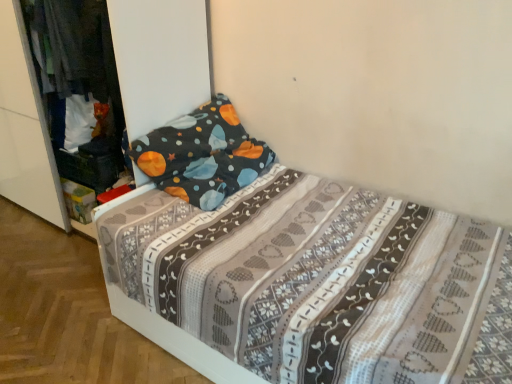
Question: Considering their positions, is dark blue fabric at left located in front of or behind white fabric bed at center?

Choices:
 (A) front
 (B) behind

Answer: (B)

Question: From a real-world perspective, is dark blue fabric at left physically located above or below white fabric bed at center?

Choices:
 (A) below
 (B) above

Answer: (B)

Question: Which of these objects is positioned farthest from the patterned fabric bed at center?

Choices:
 (A) white fabric bed at center
 (B) dark blue fabric at left

Answer: (A)

Question: Estimate the real-world distances between objects in this image. Which object is farther from the dark blue fabric at left?

Choices:
 (A) white fabric bed at center
 (B) patterned fabric bed at center

Answer: (B)